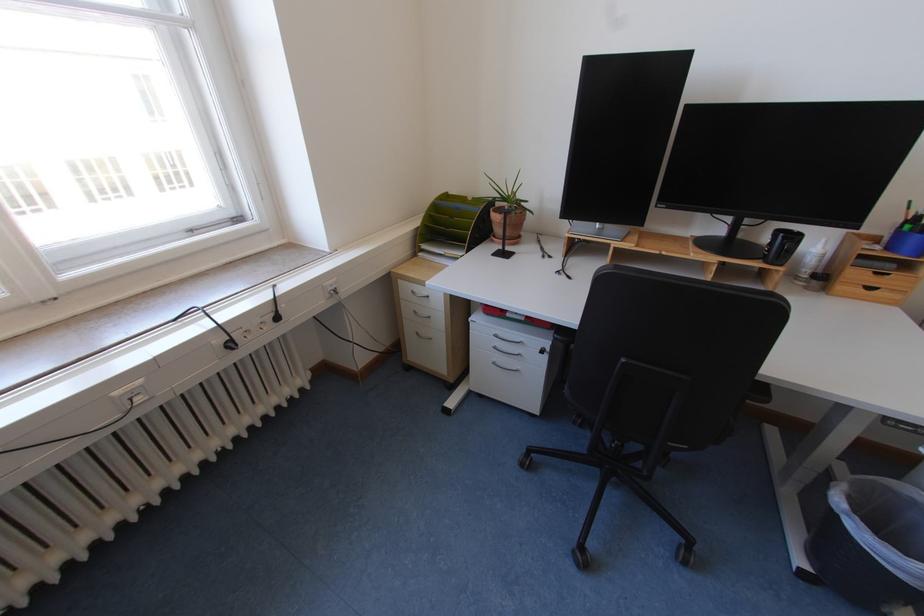
You are a GUI agent. You are given a task and a screenshot of the screen. Output one action in this format:
    pyautogui.click(x=<x>, y=<y>)
    Task: Click on the small drawer handle
    
    Given the screenshot: What is the action you would take?
    pyautogui.click(x=873, y=291)